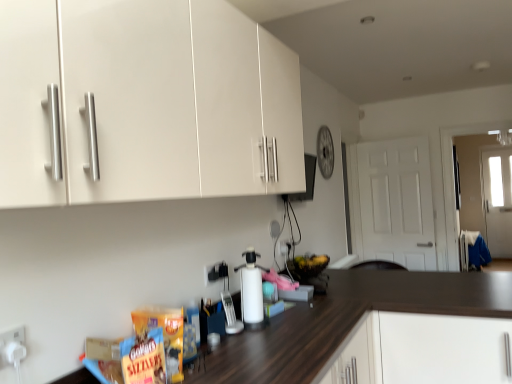
Question: Is white plastic electric outlet at center, which appears as the first electric outlet when viewed from the right, inside the boundaries of white matte bottle at center, or outside?

Choices:
 (A) inside
 (B) outside

Answer: (B)

Question: From the image's perspective, is white plastic electric outlet at center, which appears as the third electric outlet when viewed from the left, located above or below white matte bottle at center?

Choices:
 (A) below
 (B) above

Answer: (B)

Question: Which is farther from the white matte bottle at center?

Choices:
 (A) white plastic electric outlet at center, arranged as the 1th electric outlet when viewed from the back
 (B) white matte cabinet at lower right
 (C) white plastic electric outlet at lower left, positioned as the third electric outlet in back-to-front order
 (D) white plastic electric outlet at center, the 2th electric outlet when ordered from back to front
 (E) white matte door at right

Answer: (E)

Question: Estimate the real-world distances between objects in this image. Which object is closer to the white matte cabinet at lower right?

Choices:
 (A) white plastic electric outlet at center, which appears as the first electric outlet when viewed from the right
 (B) white matte door at right
 (C) white matte bottle at center
 (D) white plastic electric outlet at center, the 2th electric outlet when ordered from front to back
 (E) white plastic electric outlet at lower left, placed as the 3th electric outlet when sorted from right to left

Answer: (C)